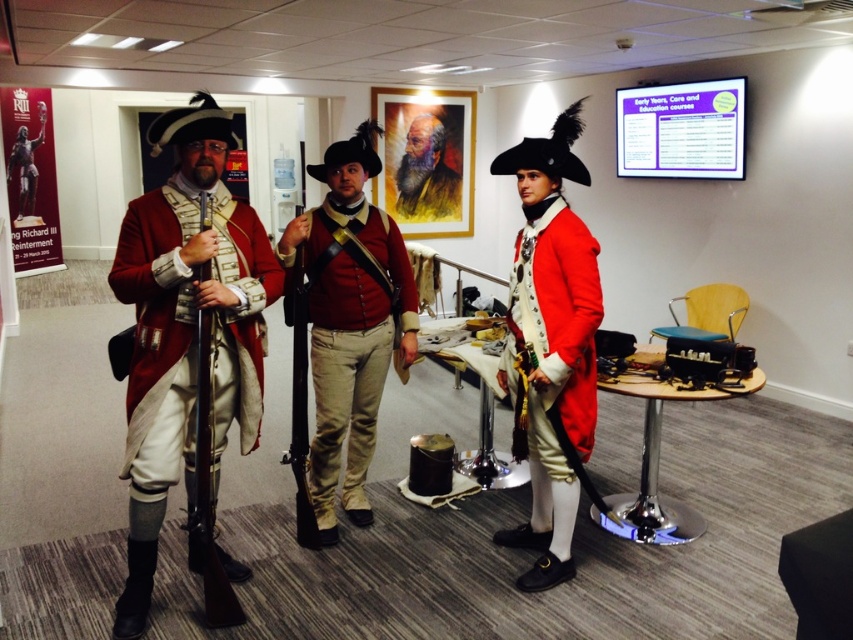
You are standing in the conference room and want to walk from the chair to the table. There are two points marked in the image. Which point should you pass through first, point (x=173, y=227) or point (x=509, y=308)?

You should pass through point (x=173, y=227) first because it is in front of point (x=509, y=308) along your path from the chair to the table.